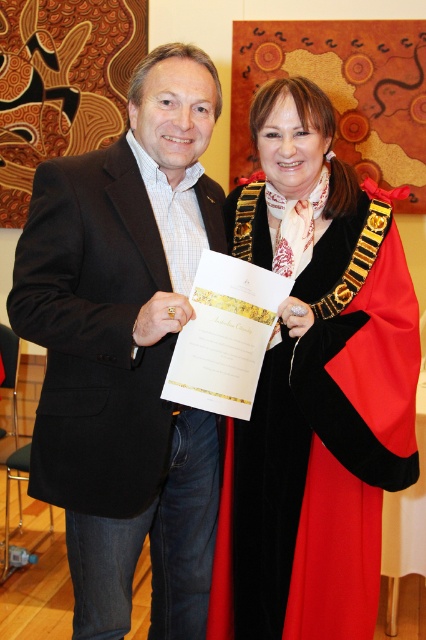
You are a photographer at a formal event. You need to capture a group photo of two people wearing the black matte suit at center and the velvet black coat at center. Which of the two clothing items has a narrower width that might allow for a tighter group shot without overlapping?

The black matte suit at center has a lesser width compared to the velvet black coat at center, so it is narrower and would allow for a tighter group shot without overlapping.

You are a photographer standing in front of the black matte suit at center and want to take a closeup photo of it. Your camera can focus on objects between 1 meter and 1.5 meters away. Can you take the photo without moving closer or farther away?

The black matte suit at center is 1.25 meters away from the viewer, which falls within the camera focus range of 1 meter to 1.5 meters. Therefore, you can take the closeup photo without moving.

You are at a formal event and need to determine which of the two points, point (169,576) or point (330,582), is closer to you. Based on the scene description, which point is nearer?

Point (169,576) is closer to you because it is further to the viewer than point (330,582).